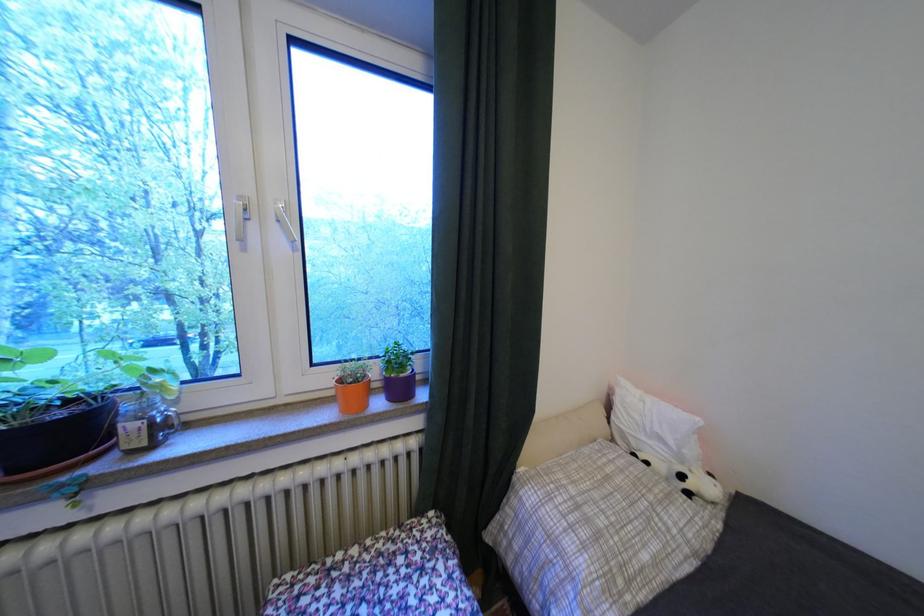
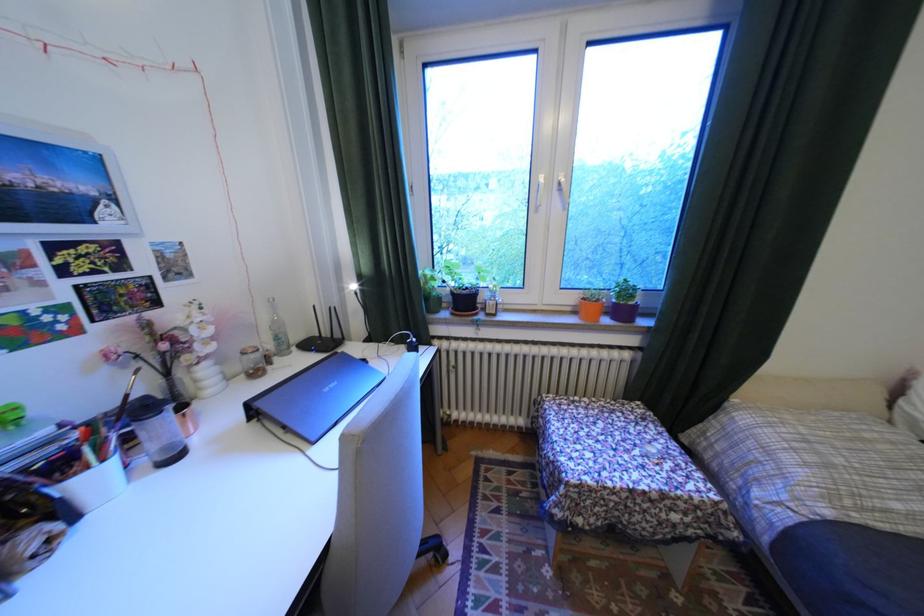
Question: The camera is either moving clockwise (left) or counter-clockwise (right) around the object. The first image is from the beginning of the video and the second image is from the end. Is the camera moving left or right when shooting the video?

Choices:
 (A) Left
 (B) Right

Answer: (B)